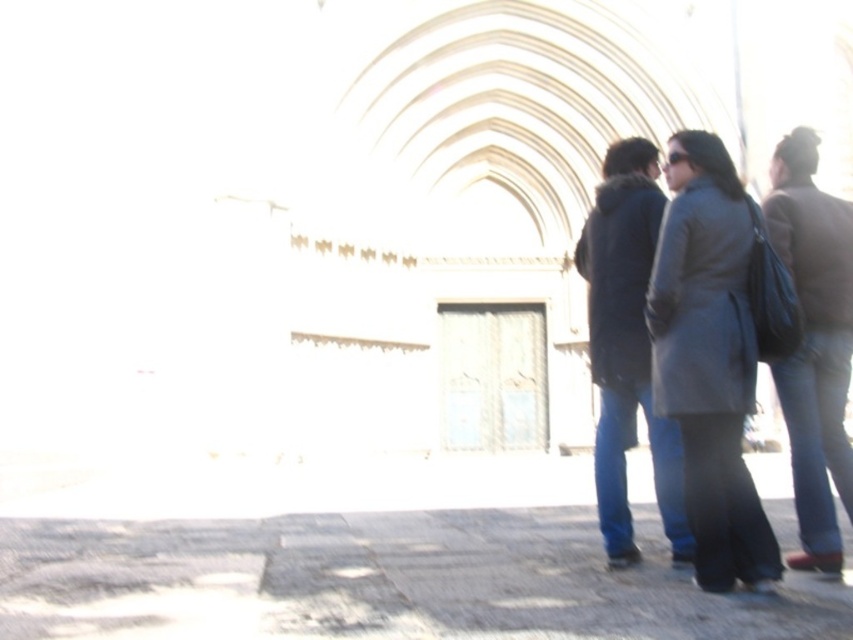
Does gray stone pavement at lower center appear on the left side of dark gray coat at right?

Yes, gray stone pavement at lower center is to the left of dark gray coat at right.

Who is more distant from viewer, [624,616] or [662,330]?

The point [662,330] is more distant.

Identify the location of gray stone pavement at lower center. The width and height of the screenshot is (853, 640). (378, 580).